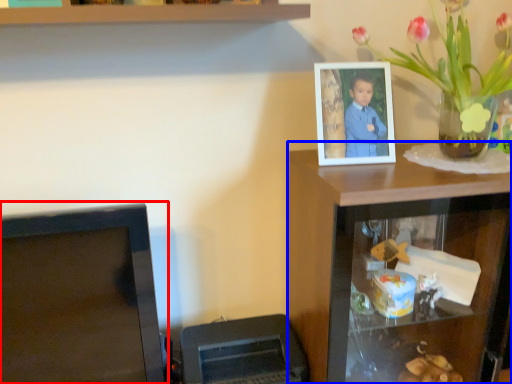
Question: Which point is further to the camera, computer monitor (highlighted by a red box) or computer desk (highlighted by a blue box)?

Choices:
 (A) computer monitor
 (B) computer desk

Answer: (B)